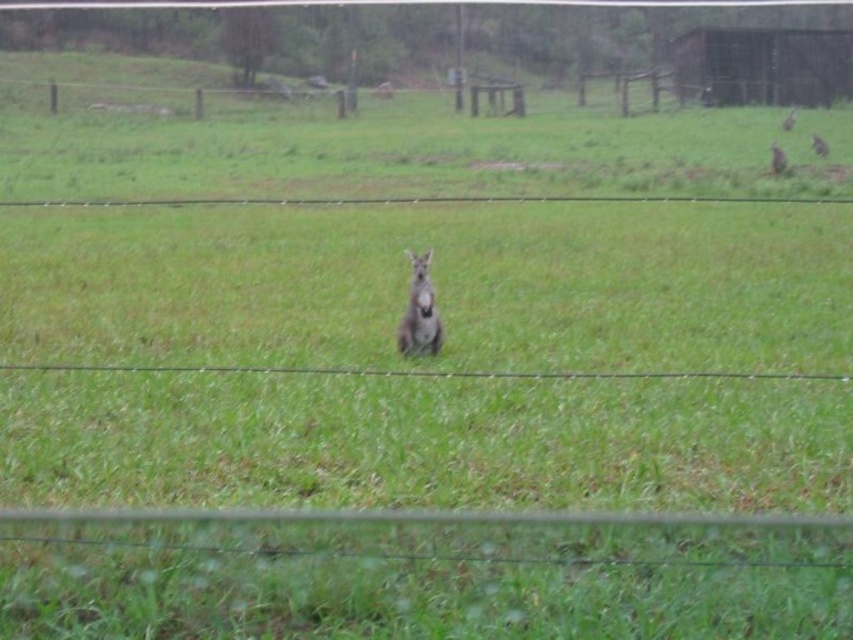
Question: Which of the following is the farthest from the observer?

Choices:
 (A) gray furry kangaroo at right
 (B) fuzzy gray kangaroo at center
 (C) gray furry kangaroo at upper right
 (D) furry gray kangaroo at upper right

Answer: (A)

Question: Which of the following is the farthest from the observer?

Choices:
 (A) (813, 140)
 (B) (473, 550)

Answer: (A)

Question: Which is farther from the gray furry kangaroo at upper right?

Choices:
 (A) fuzzy gray kangaroo at center
 (B) gray furry kangaroo at right
 (C) furry gray kangaroo at upper right
 (D) metal wire fence at lower center

Answer: (D)

Question: Is fuzzy gray kangaroo at center to the right of gray furry kangaroo at upper right from the viewer's perspective?

Choices:
 (A) no
 (B) yes

Answer: (A)

Question: Considering the relative positions of furry gray kangaroo at upper right and gray furry kangaroo at upper right in the image provided, where is furry gray kangaroo at upper right located with respect to gray furry kangaroo at upper right?

Choices:
 (A) above
 (B) below

Answer: (B)

Question: Can you confirm if metal wire fence at lower center is positioned above gray furry kangaroo at right?

Choices:
 (A) no
 (B) yes

Answer: (A)